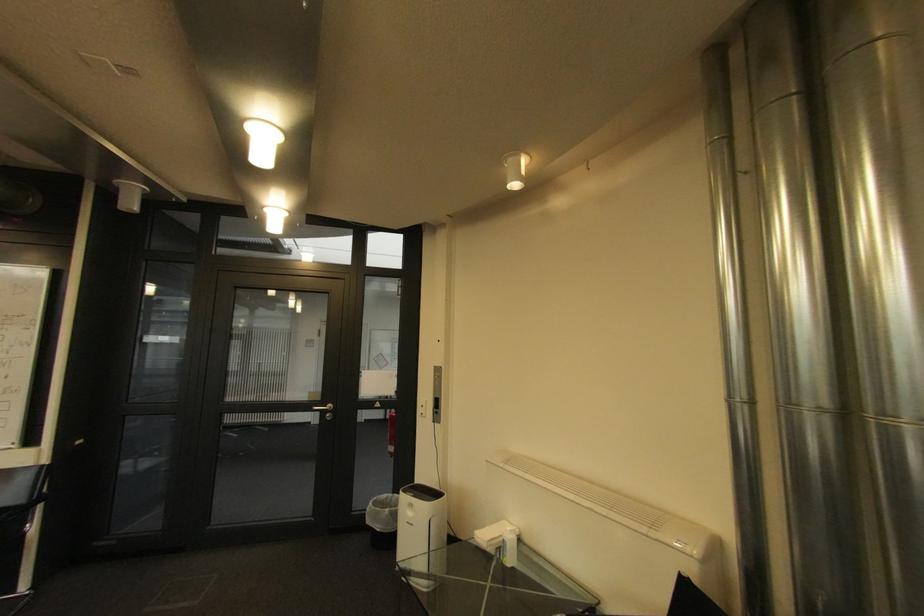
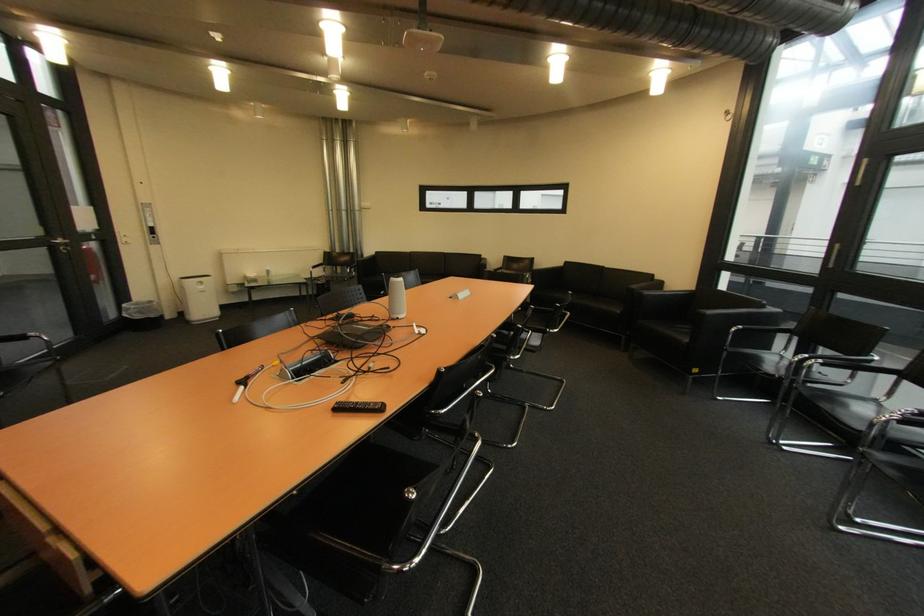
The point at (418,515) is marked in the first image. Where is the corresponding point in the second image?

(209, 288)